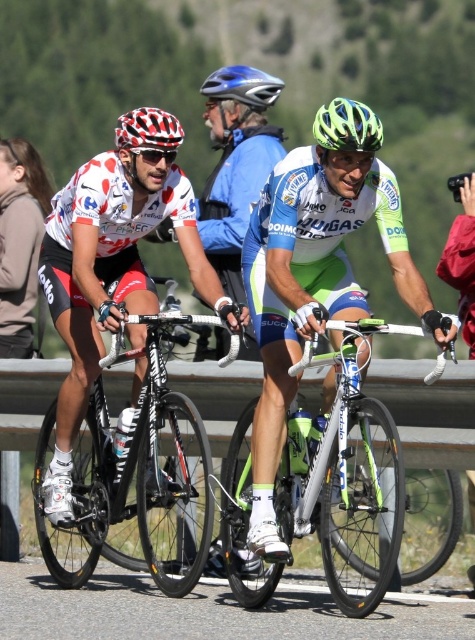
Consider the image. You are a photographer positioned at the center of the scene. You want to take a photo that includes both point (342, 374) and point (374, 131). Which point is closer to your camera lens?

Point (342, 374) is closer to the camera lens than point (374, 131) because it is further to the viewer.

You are a photographer positioned at the starting line of the race. You want to capture a photo that includes both the shiny black frame at left and the neon green matte helmet at center. Based on their positions, which object should you adjust your camera to focus on first to ensure both are in the frame?

The shiny black frame at left is to the left of the neon green matte helmet at center. To include both in the frame, focus first on the shiny black frame at left as it is positioned further left, ensuring the camera captures its position before adjusting to include the neon green matte helmet at center.

You are a photographer trying to capture a photo of the neon green matte helmet at center and the shiny black frame at left. Based on their positions, which object should you focus on first if you want to ensure both are in the same frame?

The shiny black frame at left is located below the neon green matte helmet at center, so you should focus on the neon green matte helmet at center first to ensure both are within the frame.